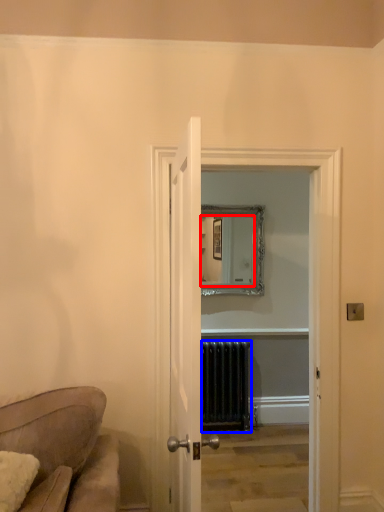
Question: Which of the following is the farthest to the observer, mirror (highlighted by a red box) or radiator (highlighted by a blue box)?

Choices:
 (A) mirror
 (B) radiator

Answer: (A)